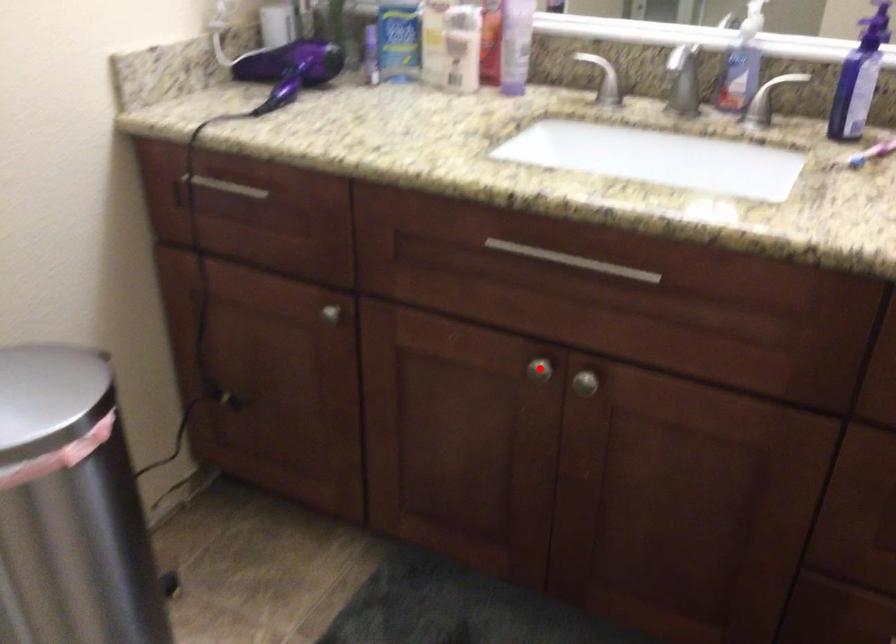
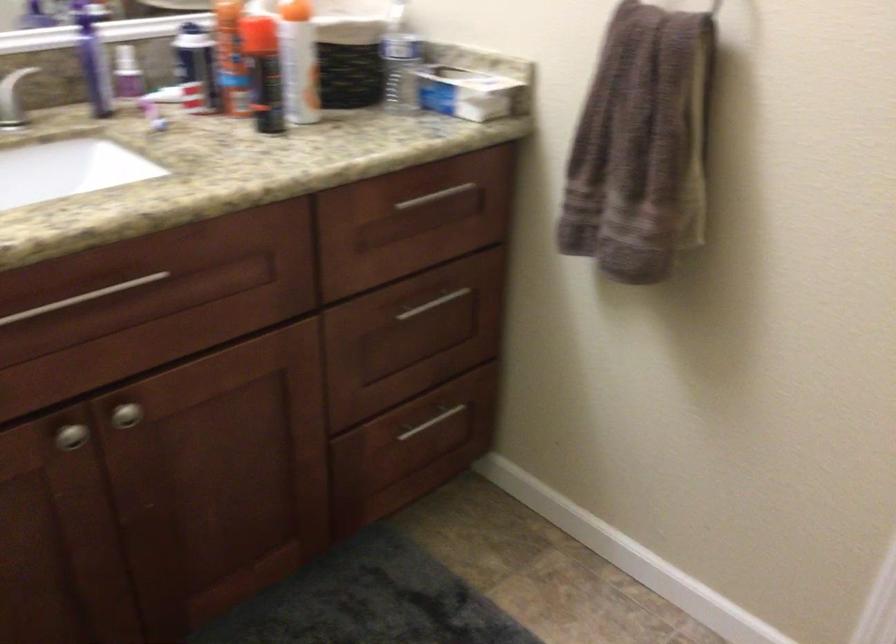
Question: I am providing you with two images of the same scene from different viewpoints. Given a red point in image1, look at the same physical point in image2. Is it:

Choices:
 (A) Closer to the viewpoint
 (B) Farther from the viewpoint

Answer: (A)